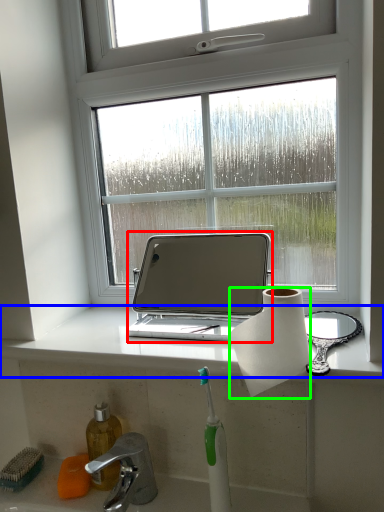
Question: Based on their relative distances, which object is nearer to laptop (highlighted by a red box)? Choose from window sill (highlighted by a blue box) and paper towel (highlighted by a green box).

Choices:
 (A) window sill
 (B) paper towel

Answer: (A)